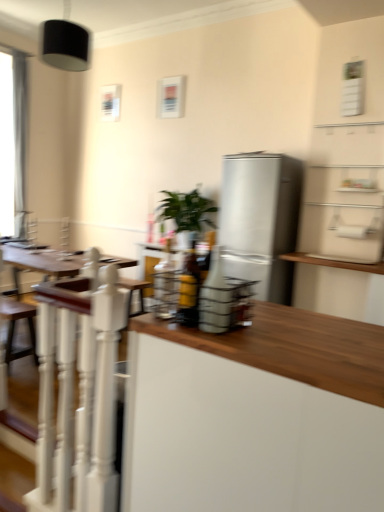
Question: Based on their positions, is black matte lampshade at upper left located to the left or right of white matte cabinet at center?

Choices:
 (A) left
 (B) right

Answer: (A)

Question: Is black matte lampshade at upper left inside or outside of white matte cabinet at center?

Choices:
 (A) outside
 (B) inside

Answer: (A)

Question: Based on their relative distances, which object is nearer to the white painted wood railing at left?

Choices:
 (A) white matte cabinet at center
 (B) green leafy plant at center
 (C) brown wooden swivel chair at lower left
 (D) satin silver refrigerator at center
 (E) black matte lampshade at upper left

Answer: (A)

Question: Which of these objects is positioned farthest from the satin silver refrigerator at center?

Choices:
 (A) green leafy plant at center
 (B) white painted wood railing at left
 (C) white matte cabinet at center
 (D) black matte lampshade at upper left
 (E) brown wooden swivel chair at lower left

Answer: (C)